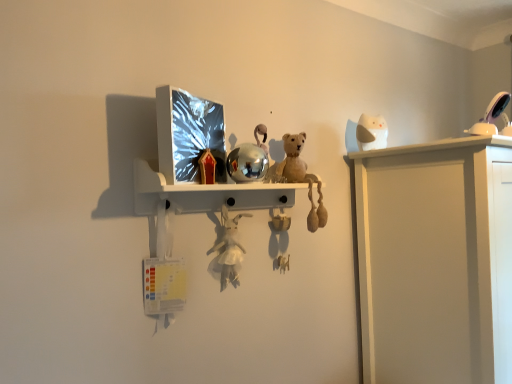
Question: Which direction should I rotate to look at white plush toy at center, acting as the third toy starting from the back?

Choices:
 (A) left
 (B) right

Answer: (A)

Question: Is white glossy lamp at upper right, which is counted as the third toy, starting from the bottom, taller than white plush toy at center, placed as the third toy when sorted from right to left?

Choices:
 (A) yes
 (B) no

Answer: (B)

Question: From a real-world perspective, does white glossy lamp at upper right, which is the second toy from back to front, stand above white plush toy at center, the third toy viewed from the top?

Choices:
 (A) yes
 (B) no

Answer: (A)

Question: Is white glossy lamp at upper right, positioned as the first toy in right-to-left order, positioned behind white plush toy at center, placed as the third toy when sorted from right to left?

Choices:
 (A) yes
 (B) no

Answer: (A)

Question: Is white glossy lamp at upper right, the 3th toy viewed from the left, bigger than white plush toy at center, acting as the third toy starting from the back?

Choices:
 (A) yes
 (B) no

Answer: (B)

Question: Is white glossy lamp at upper right, positioned as the first toy in right-to-left order, wider than white plush toy at center, acting as the third toy starting from the back?

Choices:
 (A) no
 (B) yes

Answer: (B)

Question: Considering the relative positions of white glossy lamp at upper right, the 3th toy viewed from the left, and white plush toy at center, the third toy viewed from the top, in the image provided, is white glossy lamp at upper right, the 3th toy viewed from the left, to the left of white plush toy at center, the third toy viewed from the top, from the viewer's perspective?

Choices:
 (A) no
 (B) yes

Answer: (A)

Question: Can you confirm if white plush toy at center, acting as the third toy starting from the back, is wider than white matte owl at upper right, placed as the 2th toy when sorted from bottom to top?

Choices:
 (A) no
 (B) yes

Answer: (A)

Question: Can you confirm if white plush toy at center, the third toy viewed from the top, is thinner than white matte owl at upper right, marked as the 2th toy in a top-to-bottom arrangement?

Choices:
 (A) no
 (B) yes

Answer: (B)

Question: Does white plush toy at center, positioned as the 1th toy in front-to-back order, have a larger size compared to white matte owl at upper right, which ranks as the first toy in back-to-front order?

Choices:
 (A) yes
 (B) no

Answer: (A)

Question: From a real-world perspective, is white plush toy at center, the third toy viewed from the top, physically below white matte owl at upper right, which ranks as the first toy in back-to-front order?

Choices:
 (A) no
 (B) yes

Answer: (B)

Question: Can you confirm if white plush toy at center, the third toy viewed from the top, is shorter than white matte owl at upper right, which ranks as the first toy in back-to-front order?

Choices:
 (A) no
 (B) yes

Answer: (A)

Question: From a real-world perspective, does white matte owl at upper right, placed as the 2th toy when sorted from bottom to top, stand above white glossy lamp at upper right, which is counted as the third toy, starting from the bottom?

Choices:
 (A) no
 (B) yes

Answer: (B)